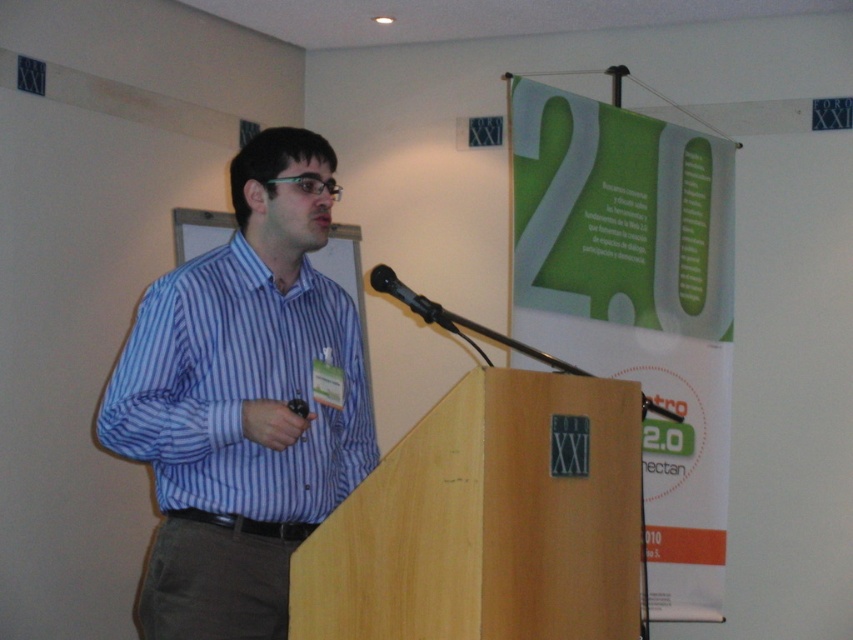
Between blue striped shirt at center and black plastic microphone at center, which one is positioned lower?

blue striped shirt at center is below.

Does point (345, 307) come farther from viewer compared to point (374, 284)?

Yes, point (345, 307) is farther from viewer.

Find the location of a particular element. blue striped shirt at center is located at coordinates (242, 401).